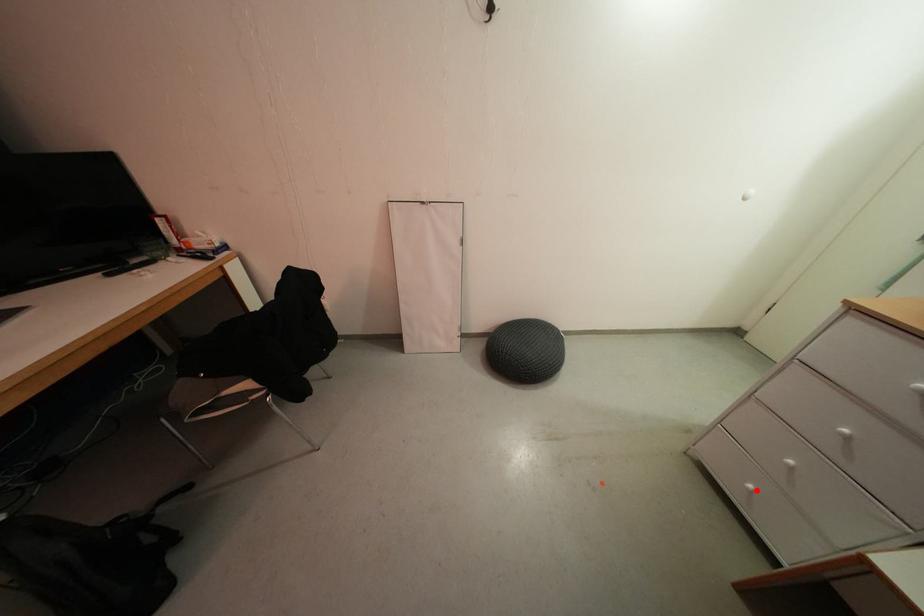
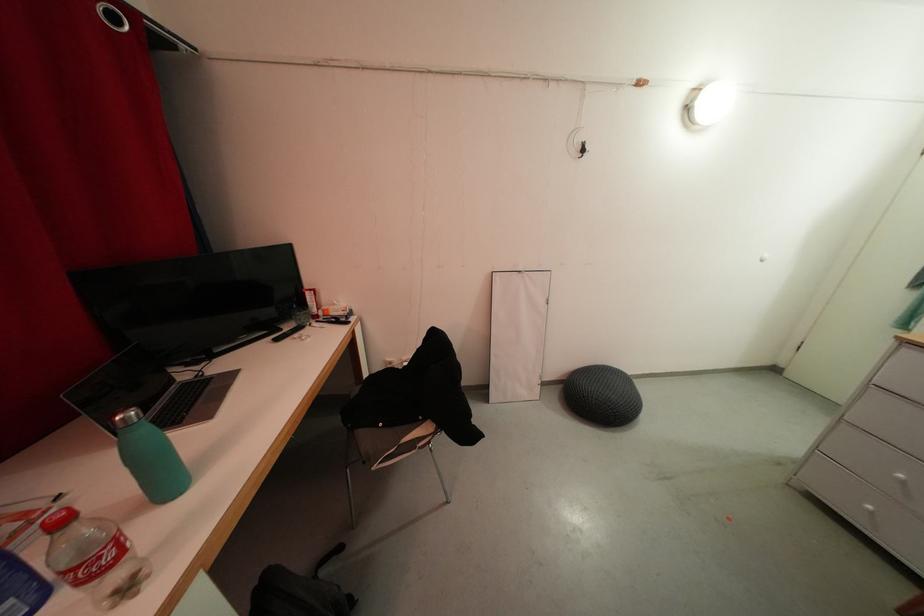
Question: I am providing you with two images of the same scene from different viewpoints. Given a red point in image1, look at the same physical point in image2. Is it:

Choices:
 (A) Closer to the viewpoint
 (B) Farther from the viewpoint

Answer: (B)